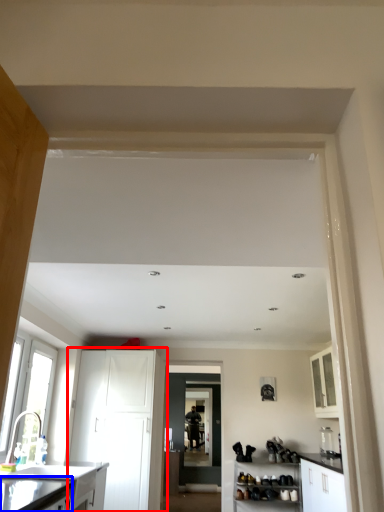
Question: Which point is closer to the camera, cabinetry (highlighted by a red box) or counter top (highlighted by a blue box)?

Choices:
 (A) cabinetry
 (B) counter top

Answer: (B)